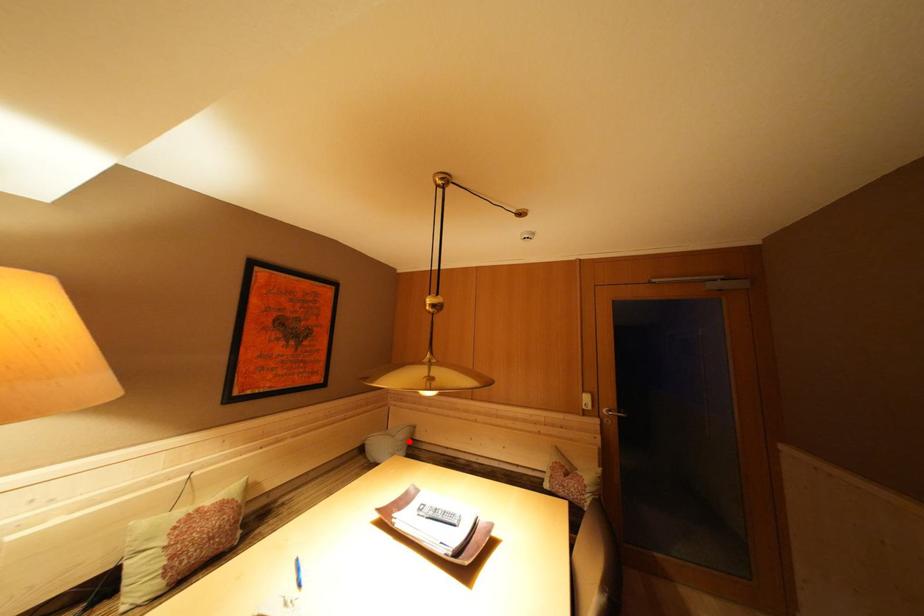
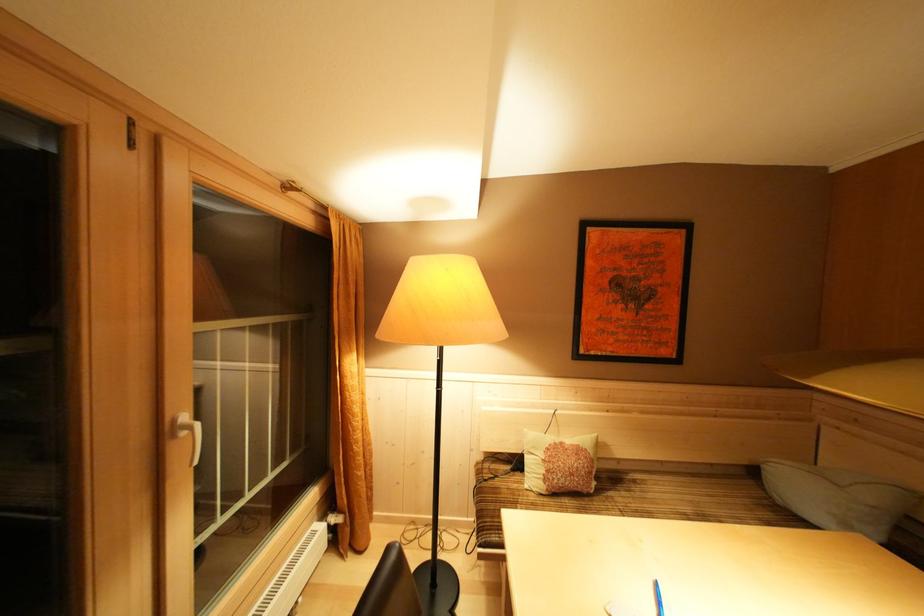
Question: I am providing you with two images of the same scene from different viewpoints. In image1, a red point is highlighted. Considering the same 3D point in image2, which of the following is correct?

Choices:
 (A) It is closer
 (B) It is farther

Answer: (A)